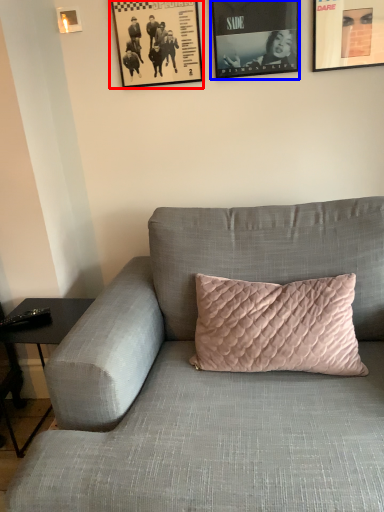
Question: Among these objects, which one is nearest to the camera, picture frame (highlighted by a red box) or picture frame (highlighted by a blue box)?

Choices:
 (A) picture frame
 (B) picture frame

Answer: (B)